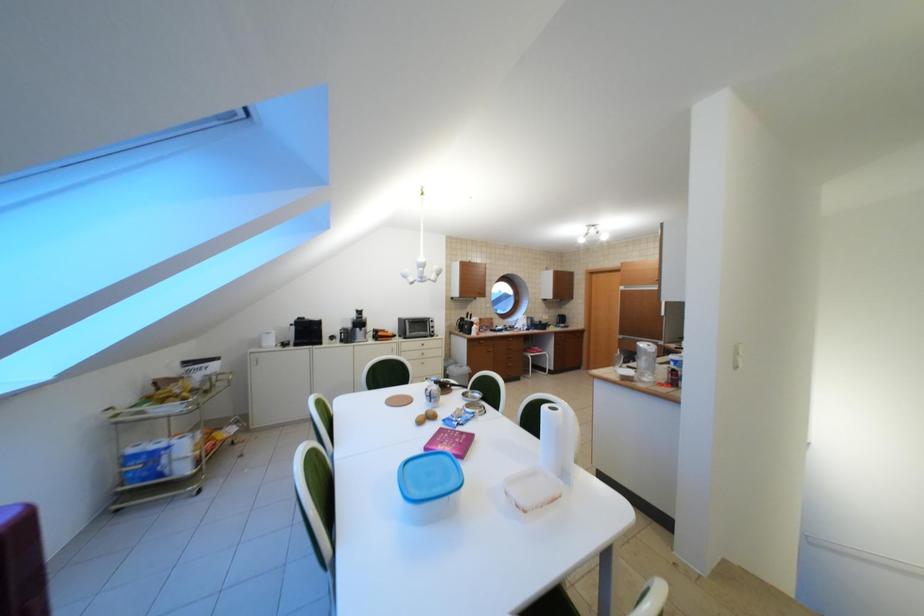
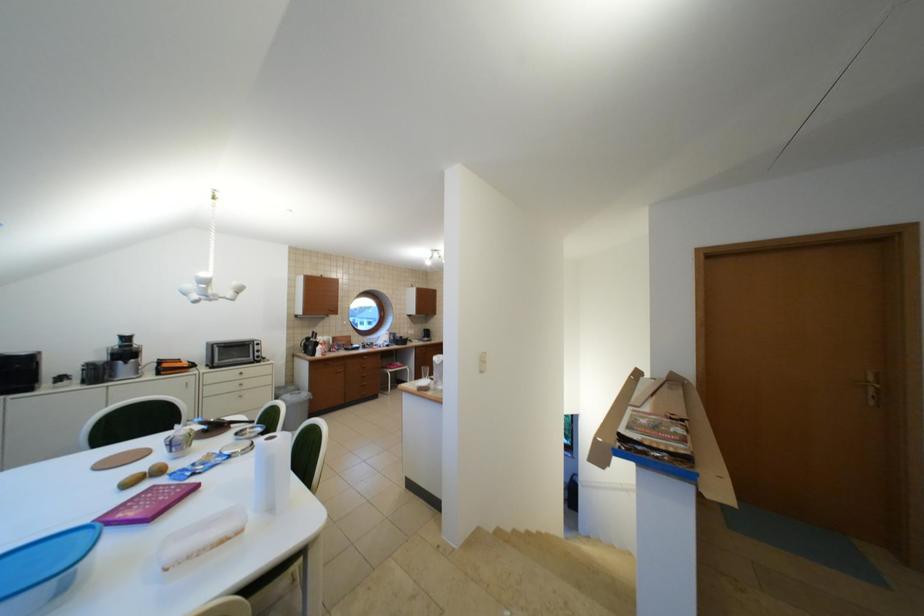
Question: The images are taken continuously from a first-person perspective. In which direction is your viewpoint rotating?

Choices:
 (A) Left
 (B) Right
 (C) Up
 (D) Down

Answer: (B)